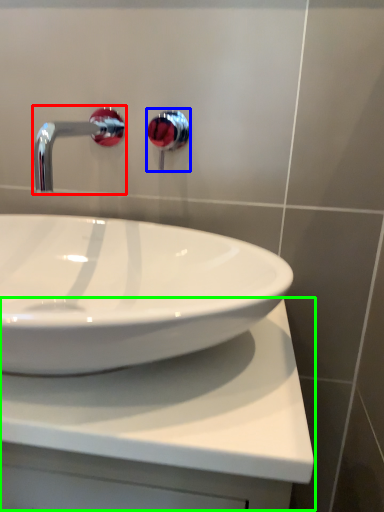
Question: Considering the real-world distances, which object is closest to tap (highlighted by a red box)? plumbing fixture (highlighted by a blue box) or counter top (highlighted by a green box).

Choices:
 (A) plumbing fixture
 (B) counter top

Answer: (B)